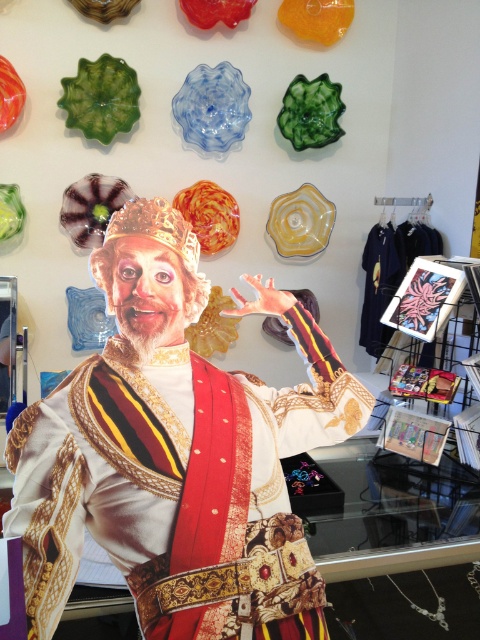
Question: Estimate the real-world distances between objects in this image. Which object is closer to the matte gold fabric at center?

Choices:
 (A) translucent glass plate at upper left
 (B) transparent blue glass plate at upper center
 (C) shiny orange glass plate at center

Answer: (A)

Question: Which of the following is the closest to the observer?

Choices:
 (A) translucent glass plate at upper left
 (B) transparent blue glass plate at upper center

Answer: (A)

Question: Which object appears farthest from the camera in this image?

Choices:
 (A) transparent blue glass plate at upper center
 (B) translucent yellow glass plate at upper center
 (C) shiny orange glass plate at center
 (D) translucent glass plate at upper left

Answer: (B)

Question: Does translucent glass plate at upper left lie in front of shiny orange glass plate at center?

Choices:
 (A) no
 (B) yes

Answer: (B)

Question: Is transparent blue glass plate at upper center bigger than shiny orange glass plate at center?

Choices:
 (A) no
 (B) yes

Answer: (B)

Question: Does matte gold fabric at center come behind transparent blue glass plate at upper center?

Choices:
 (A) no
 (B) yes

Answer: (A)